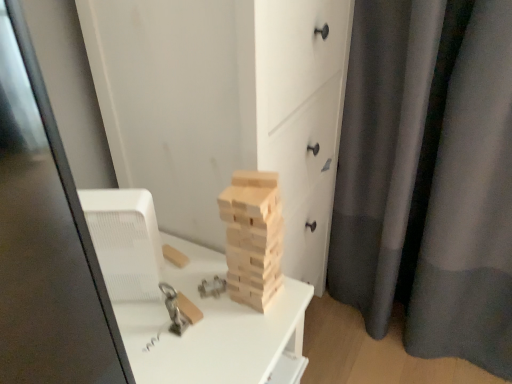
Question: Is natural wood blocks at center to the right of wooden blocks at center from the viewer's perspective?

Choices:
 (A) yes
 (B) no

Answer: (A)

Question: Is natural wood blocks at center shorter than wooden blocks at center?

Choices:
 (A) yes
 (B) no

Answer: (A)

Question: Is natural wood blocks at center bigger than wooden blocks at center?

Choices:
 (A) no
 (B) yes

Answer: (A)

Question: Is natural wood blocks at center wider than wooden blocks at center?

Choices:
 (A) yes
 (B) no

Answer: (B)

Question: Does natural wood blocks at center appear on the left side of wooden blocks at center?

Choices:
 (A) yes
 (B) no

Answer: (B)

Question: From the image's perspective, is wooden blocks at center above or below natural wood blocks at center?

Choices:
 (A) below
 (B) above

Answer: (B)

Question: Considering the positions of wooden blocks at center and natural wood blocks at center in the image, is wooden blocks at center bigger or smaller than natural wood blocks at center?

Choices:
 (A) small
 (B) big

Answer: (B)

Question: In terms of height, does wooden blocks at center look taller or shorter compared to natural wood blocks at center?

Choices:
 (A) short
 (B) tall

Answer: (B)

Question: Is point (197, 16) closer or farther from the camera than point (280, 231)?

Choices:
 (A) closer
 (B) farther

Answer: (A)

Question: Would you say gray matte curtain at right is to the left or to the right of natural wood blocks at center in the picture?

Choices:
 (A) right
 (B) left

Answer: (A)

Question: Is gray matte curtain at right spatially inside natural wood blocks at center, or outside of it?

Choices:
 (A) inside
 (B) outside

Answer: (B)

Question: From a real-world perspective, is gray matte curtain at right physically located above or below natural wood blocks at center?

Choices:
 (A) above
 (B) below

Answer: (B)

Question: Considering the positions of gray matte curtain at right and natural wood blocks at center in the image, is gray matte curtain at right wider or thinner than natural wood blocks at center?

Choices:
 (A) thin
 (B) wide

Answer: (B)

Question: In terms of size, does wooden blocks at center appear bigger or smaller than gray matte curtain at right?

Choices:
 (A) small
 (B) big

Answer: (B)

Question: From the image's perspective, is wooden blocks at center located above or below gray matte curtain at right?

Choices:
 (A) below
 (B) above

Answer: (A)